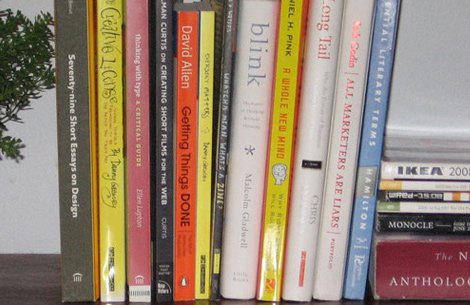
At what (x,y) coordinates should I click in order to perform the action: click on table. Please return your answer as a coordinate pair (x, y). This screenshot has width=470, height=305. Looking at the image, I should click on (42, 263).